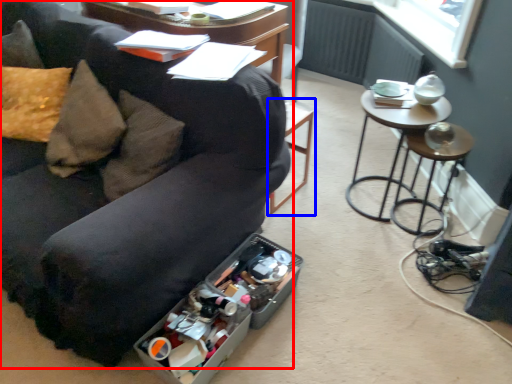
Question: Which object appears farthest to the camera in this image, studio couch (highlighted by a red box) or bar stool (highlighted by a blue box)?

Choices:
 (A) studio couch
 (B) bar stool

Answer: (B)